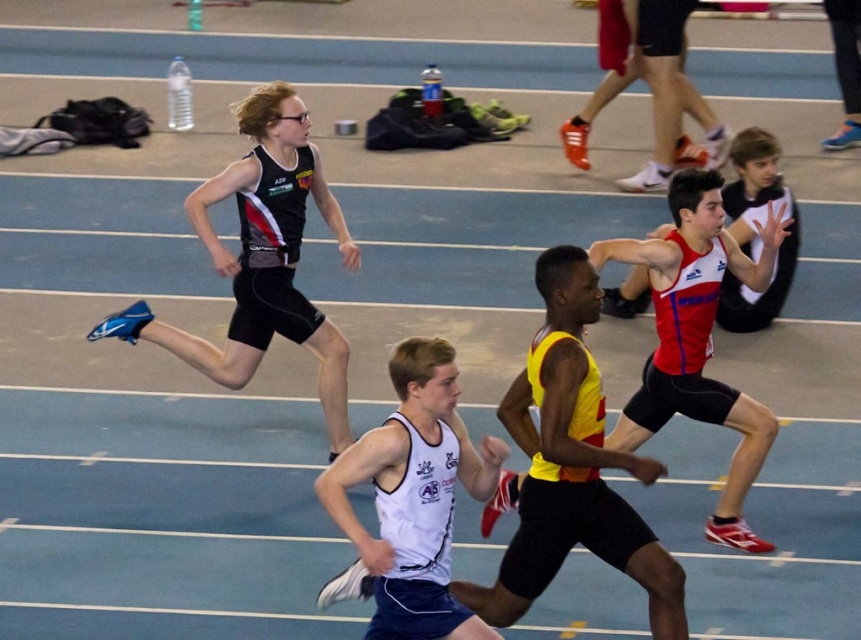
How distant is matte black singlet at upper left from red matte tank top at center?

matte black singlet at upper left is 2.30 meters from red matte tank top at center.

Who is more distant from viewer, (319, 365) or (740, 422)?

Positioned behind is point (319, 365).

Identify the location of matte black singlet at upper left. (263, 259).

Which is in front, point (556, 486) or point (624, 246)?

Point (556, 486) is in front.

Is the position of yellow/yellowish matte tank top at center more distant than that of red matte tank top at center?

That is False.

The image size is (861, 640). What do you see at coordinates (571, 467) in the screenshot?
I see `yellow/yellowish matte tank top at center` at bounding box center [571, 467].

Image resolution: width=861 pixels, height=640 pixels. I want to click on yellow/yellowish matte tank top at center, so click(571, 467).

Who is positioned more to the right, matte black singlet at upper left or white matte tank top at center?

From the viewer's perspective, white matte tank top at center appears more on the right side.

Is point (223, 371) more distant than point (393, 560)?

That is True.

Where is `matte black singlet at upper left`? matte black singlet at upper left is located at coordinates (263, 259).